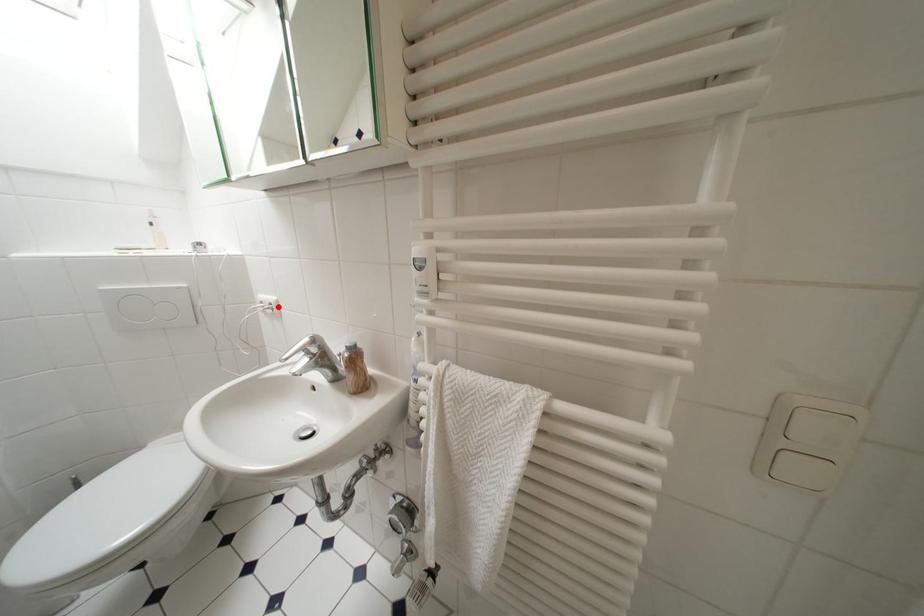
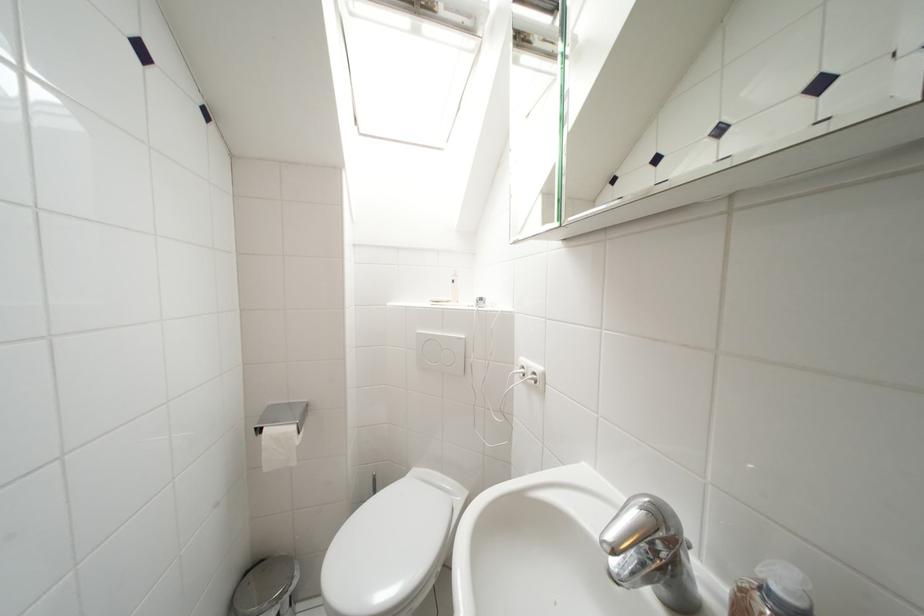
In the second image, find the point that corresponds to the highlighted location in the first image.

(541, 377)